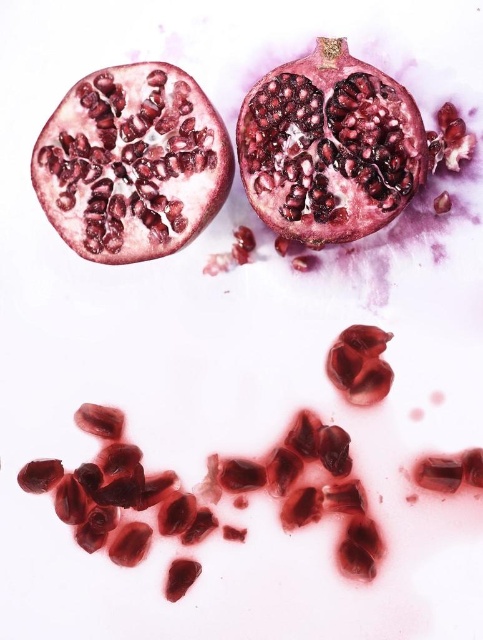
You are trying to pick up the shiny red pomegranate seed at center without touching the shiny red pomegranate at upper left. Can you reach it with a 12 inch long tongs?

The distance between the shiny red pomegranate at upper left and the shiny red pomegranate seed at center is 18.41 inches. Since the tongs are only 12 inches long, you cannot reach the seed without touching the pomegranate.

You are looking at the pomegranate halves and spilled seeds. There are two points marked in the image. Which point, point (x=197, y=196) or point (x=368, y=333), is closer to you?

Point (x=197, y=196) is closer to the viewer than point (x=368, y=333).